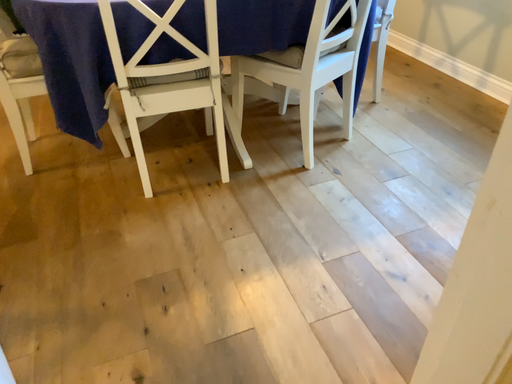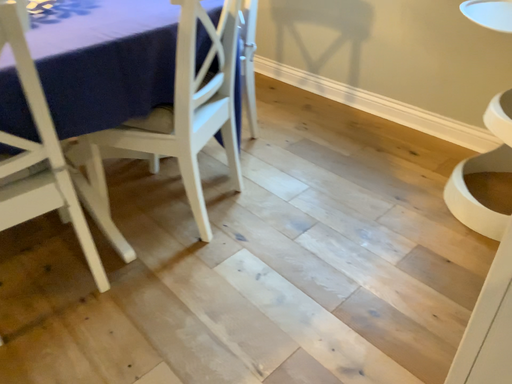
Question: How did the camera likely rotate when shooting the video?

Choices:
 (A) rotated left
 (B) rotated right

Answer: (B)